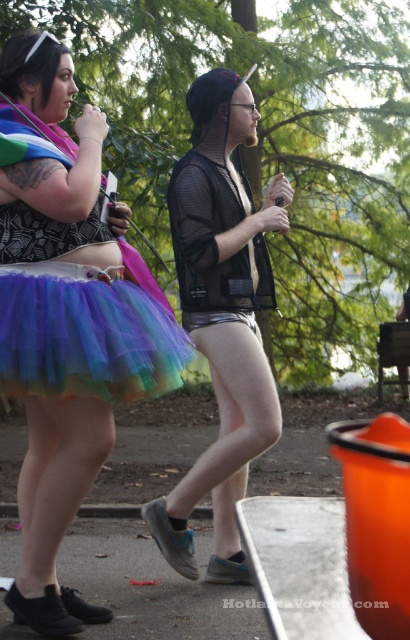
From the picture: Measure the distance from rainbow tulle skirt at left to mesh fabric jacket at center.

34.25 inches

Who is shorter, rainbow tulle skirt at left or mesh fabric jacket at center?

rainbow tulle skirt at left is shorter.

This screenshot has height=640, width=410. What are the coordinates of `rainbow tulle skirt at left` in the screenshot? It's located at (66, 317).

What are the coordinates of `rainbow tulle skirt at left` in the screenshot? It's located at (66, 317).

Can you confirm if mesh fabric jacket at center is taller than rainbow tulle skirt at lower left?

Correct, mesh fabric jacket at center is much taller as rainbow tulle skirt at lower left.

Between point (186, 326) and point (88, 332), which one is positioned in front?

Point (88, 332) is in front.

Does point (223, 176) lie in front of point (168, 339)?

No, (223, 176) is behind (168, 339).

Locate an element on the screen. The height and width of the screenshot is (640, 410). mesh fabric jacket at center is located at coordinates (221, 316).

Is rainbow tulle skirt at left shorter than rainbow tulle skirt at lower left?

No.

Is point (18, 52) farther from viewer compared to point (152, 337)?

That is True.

Image resolution: width=410 pixels, height=640 pixels. I want to click on rainbow tulle skirt at left, so click(x=66, y=317).